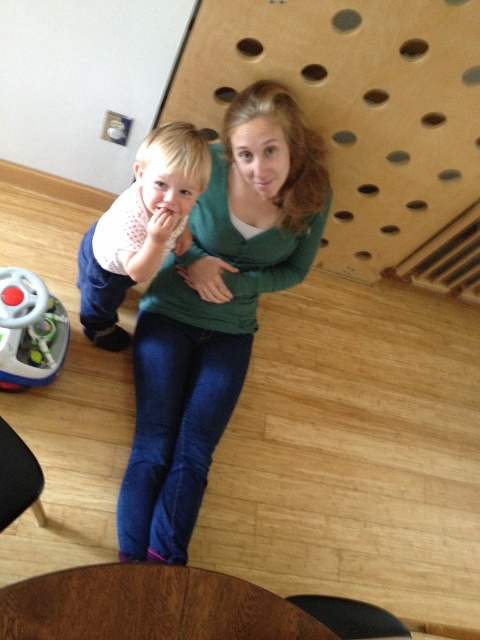
Measure the distance between brown wood round table at lower center and camera.

They are 34.09 inches apart.

Between point (214, 605) and point (147, 186), which one is positioned behind?

The point (147, 186) is behind.

Where is `brown wood round table at lower center`? brown wood round table at lower center is located at coordinates coord(148,605).

Which of these two, green matte sweater at center or brown wood round table at lower center, stands taller?

With more height is green matte sweater at center.

Can you confirm if green matte sweater at center is thinner than brown wood round table at lower center?

Yes.

You are a GUI agent. You are given a task and a screenshot of the screen. Output one action in this format:
    pyautogui.click(x=<x>, y=<y>)
    Task: Click on the green matte sweater at center
    
    Given the screenshot: What is the action you would take?
    pyautogui.click(x=216, y=310)

I want to click on green matte sweater at center, so click(216, 310).

Looking at this image, which is below, matte white shirt at center or plastic steering wheel at lower left?

Positioned lower is plastic steering wheel at lower left.

Can you confirm if matte white shirt at center is shorter than plastic steering wheel at lower left?

In fact, matte white shirt at center may be taller than plastic steering wheel at lower left.

I want to click on matte white shirt at center, so click(x=141, y=227).